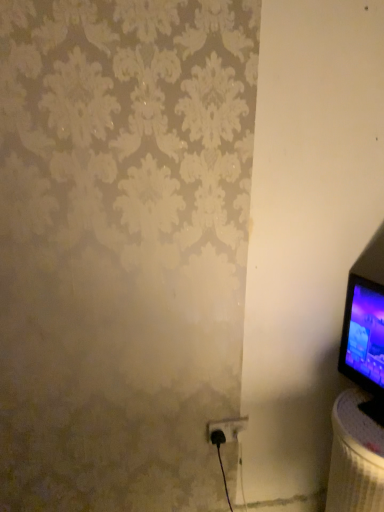
Question: From the image's perspective, is black plastic power plug at lower right below white textured table at lower right?

Choices:
 (A) no
 (B) yes

Answer: (A)

Question: Can we say black plastic power plug at lower right lies outside white textured table at lower right?

Choices:
 (A) no
 (B) yes

Answer: (B)

Question: Can you confirm if black plastic power plug at lower right is thinner than white textured table at lower right?

Choices:
 (A) no
 (B) yes

Answer: (B)

Question: Does black plastic power plug at lower right touch white textured table at lower right?

Choices:
 (A) yes
 (B) no

Answer: (B)

Question: Could you tell me if black plastic power plug at lower right is facing white textured table at lower right?

Choices:
 (A) yes
 (B) no

Answer: (B)

Question: Does black plastic power plug at lower right have a lesser height compared to white textured table at lower right?

Choices:
 (A) no
 (B) yes

Answer: (B)

Question: Does white textured table at lower right have a greater height compared to black plastic power plug at lower right?

Choices:
 (A) yes
 (B) no

Answer: (A)

Question: From a real-world perspective, is white textured table at lower right positioned under black plastic power plug at lower right based on gravity?

Choices:
 (A) no
 (B) yes

Answer: (B)

Question: From the image's perspective, is white textured table at lower right located beneath black plastic power plug at lower right?

Choices:
 (A) no
 (B) yes

Answer: (B)

Question: Is white textured table at lower right next to black plastic power plug at lower right?

Choices:
 (A) no
 (B) yes

Answer: (A)

Question: From the image's perspective, would you say white textured table at lower right is positioned over black plastic power plug at lower right?

Choices:
 (A) yes
 (B) no

Answer: (B)

Question: Is white textured table at lower right located outside black plastic power plug at lower right?

Choices:
 (A) yes
 (B) no

Answer: (A)

Question: Considering the positions of point (244, 421) and point (370, 481), is point (244, 421) closer or farther from the camera than point (370, 481)?

Choices:
 (A) closer
 (B) farther

Answer: (B)